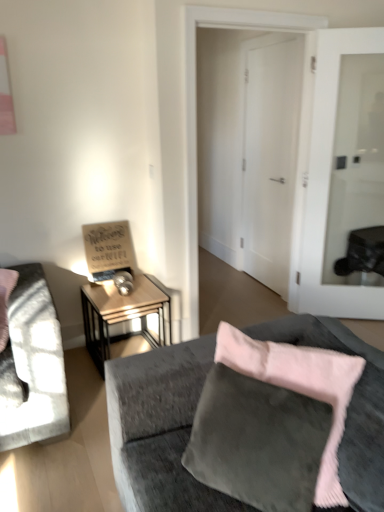
Question: Considering the relative sizes of velvet gray couch at lower right and wooden side table at center left in the image provided, is velvet gray couch at lower right taller than wooden side table at center left?

Choices:
 (A) yes
 (B) no

Answer: (A)

Question: Is velvet gray couch at lower right not within wooden side table at center left?

Choices:
 (A) yes
 (B) no

Answer: (A)

Question: Are velvet gray couch at lower right and wooden side table at center left making contact?

Choices:
 (A) no
 (B) yes

Answer: (A)

Question: Considering the relative sizes of velvet gray couch at lower right and wooden side table at center left in the image provided, is velvet gray couch at lower right shorter than wooden side table at center left?

Choices:
 (A) yes
 (B) no

Answer: (B)

Question: From a real-world perspective, is velvet gray couch at lower right beneath wooden side table at center left?

Choices:
 (A) yes
 (B) no

Answer: (B)

Question: Can you confirm if velvet gray couch at lower right is positioned to the right of wooden side table at center left?

Choices:
 (A) yes
 (B) no

Answer: (A)

Question: Can you confirm if wooden sign at left is positioned to the right of metallic silver table lamp at left?

Choices:
 (A) yes
 (B) no

Answer: (B)

Question: From the image's perspective, is wooden sign at left beneath metallic silver table lamp at left?

Choices:
 (A) yes
 (B) no

Answer: (B)

Question: Is wooden sign at left with metallic silver table lamp at left?

Choices:
 (A) no
 (B) yes

Answer: (A)

Question: Is wooden sign at left surrounding metallic silver table lamp at left?

Choices:
 (A) no
 (B) yes

Answer: (A)

Question: Can we say wooden sign at left lies outside metallic silver table lamp at left?

Choices:
 (A) no
 (B) yes

Answer: (B)

Question: Is wooden sign at left turned away from metallic silver table lamp at left?

Choices:
 (A) no
 (B) yes

Answer: (A)

Question: From the image's perspective, is wooden sign at left beneath white glass door at center, the 1th door in the right-to-left sequence?

Choices:
 (A) no
 (B) yes

Answer: (B)